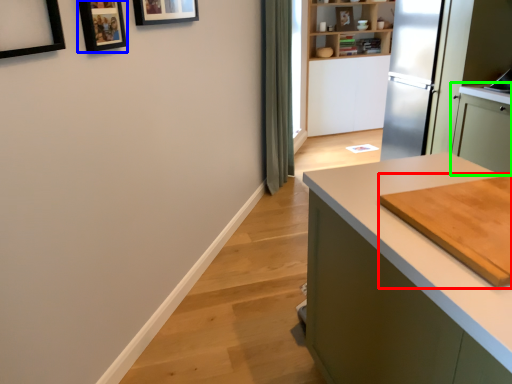
Question: Estimate the real-world distances between objects in this image. Which object is farther from cutting board (highlighted by a red box), picture frame (highlighted by a blue box) or cabinetry (highlighted by a green box)?

Choices:
 (A) picture frame
 (B) cabinetry

Answer: (B)